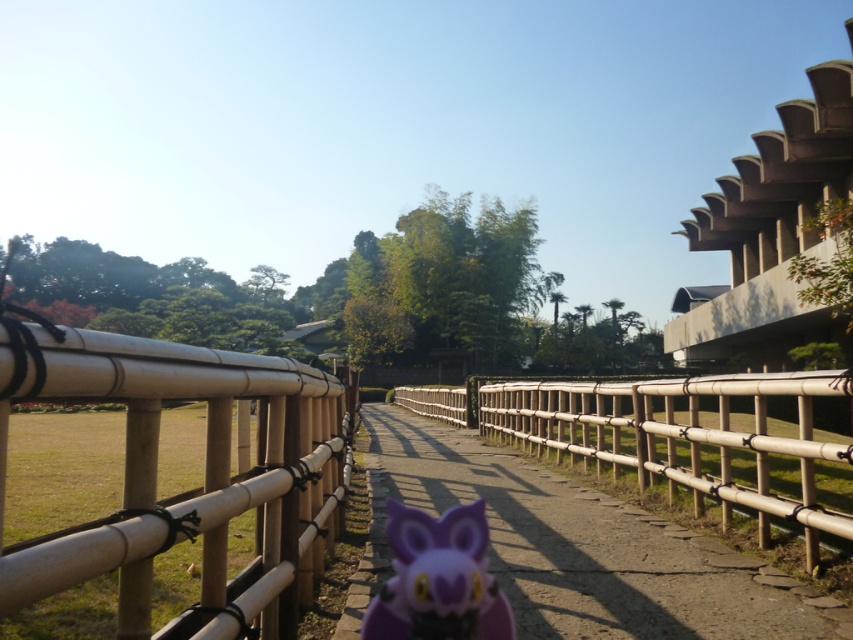
Question: Which of the following is the farthest from the observer?

Choices:
 (A) (86, 381)
 (B) (404, 451)
 (C) (479, 627)

Answer: (B)

Question: Considering the relative positions of natural bamboo fence at center and purple matte owl at center in the image provided, where is natural bamboo fence at center located with respect to purple matte owl at center?

Choices:
 (A) above
 (B) below

Answer: (A)

Question: Is natural bamboo fence at center closer to the viewer compared to purple plastic owl at center?

Choices:
 (A) no
 (B) yes

Answer: (B)

Question: Which of the following is the closest to the observer?

Choices:
 (A) purple plastic owl at center
 (B) natural bamboo fence at center
 (C) purple matte owl at center

Answer: (B)

Question: Estimate the real-world distances between objects in this image. Which object is farther from the purple matte owl at center?

Choices:
 (A) purple plastic owl at center
 (B) natural bamboo fence at center

Answer: (A)

Question: Is purple plastic owl at center closer to camera compared to purple matte owl at center?

Choices:
 (A) yes
 (B) no

Answer: (B)